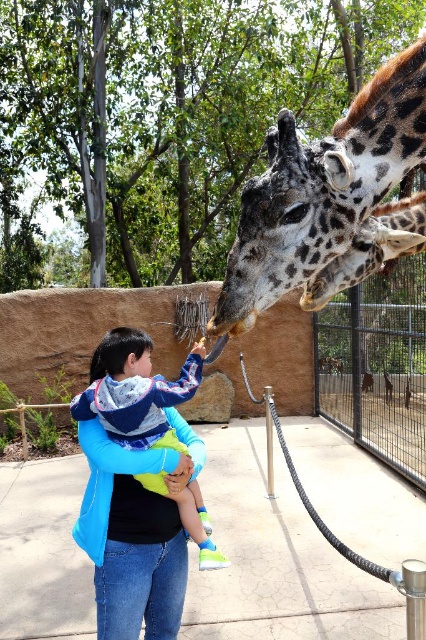
Question: Estimate the real-world distances between objects in this image. Which object is closer to the metal wire fence at center?

Choices:
 (A) spotted fur giraffe at center
 (B) blue fleece jacket at center

Answer: (A)

Question: Which object is farther from the camera taking this photo?

Choices:
 (A) spotted fur giraffe at center
 (B) blue fleece jacket at center
 (C) spotted fur giraffe at upper center

Answer: (B)

Question: Is spotted fur giraffe at upper center wider than metal wire fence at center?

Choices:
 (A) yes
 (B) no

Answer: (B)

Question: Can you confirm if spotted fur giraffe at upper center is wider than blue fleece jacket at center?

Choices:
 (A) no
 (B) yes

Answer: (B)

Question: Is spotted fur giraffe at upper center to the left of blue fleece jacket at center from the viewer's perspective?

Choices:
 (A) yes
 (B) no

Answer: (B)

Question: Which of the following is the closest to the observer?

Choices:
 (A) spotted fur giraffe at upper center
 (B) blue fleece jacket at center
 (C) metal wire fence at center

Answer: (A)